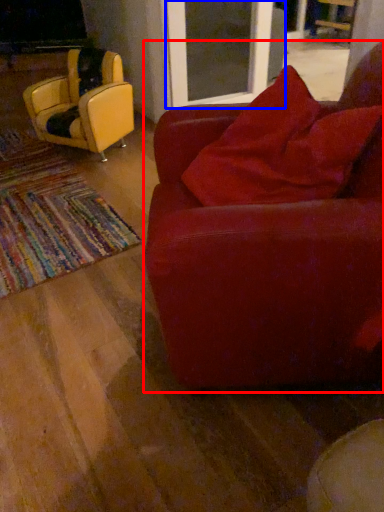
Question: Among these objects, which one is farthest to the camera, chair (highlighted by a red box) or screen door (highlighted by a blue box)?

Choices:
 (A) chair
 (B) screen door

Answer: (B)